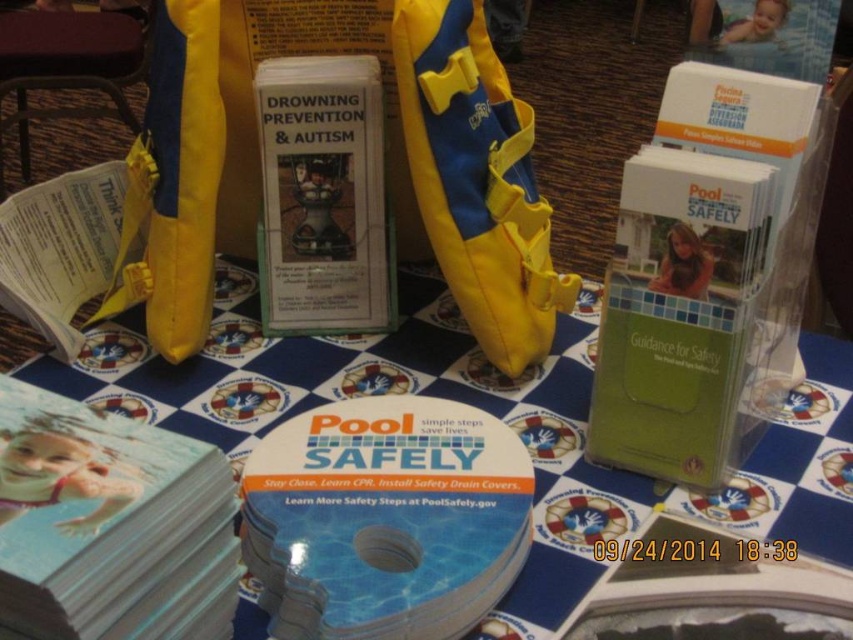
Question: Is yellow fabric life vest at center wider than matte plastic toy at center?

Choices:
 (A) yes
 (B) no

Answer: (A)

Question: Does yellow fabric life vest at center appear under matte white brochure at center?

Choices:
 (A) yes
 (B) no

Answer: (B)

Question: Which point appears closest to the camera in this image?

Choices:
 (A) (329, 355)
 (B) (51, 499)

Answer: (B)

Question: Does blue printed paper at center appear under yellow fabric life vest at center?

Choices:
 (A) yes
 (B) no

Answer: (A)

Question: Estimate the real-world distances between objects in this image. Which object is closer to the matte plastic toy at center?

Choices:
 (A) yellow paper at left
 (B) matte white brochure at center

Answer: (B)

Question: Among these points, which one is nearest to the camera?

Choices:
 (A) [74, 568]
 (B) [798, 531]

Answer: (A)